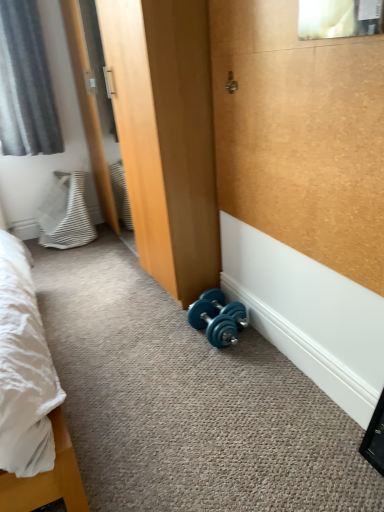
Locate an element on the screen. The width and height of the screenshot is (384, 512). vacant location below teal rubber dumbbell at lower center (from a real-world perspective) is located at coordinates (203, 334).